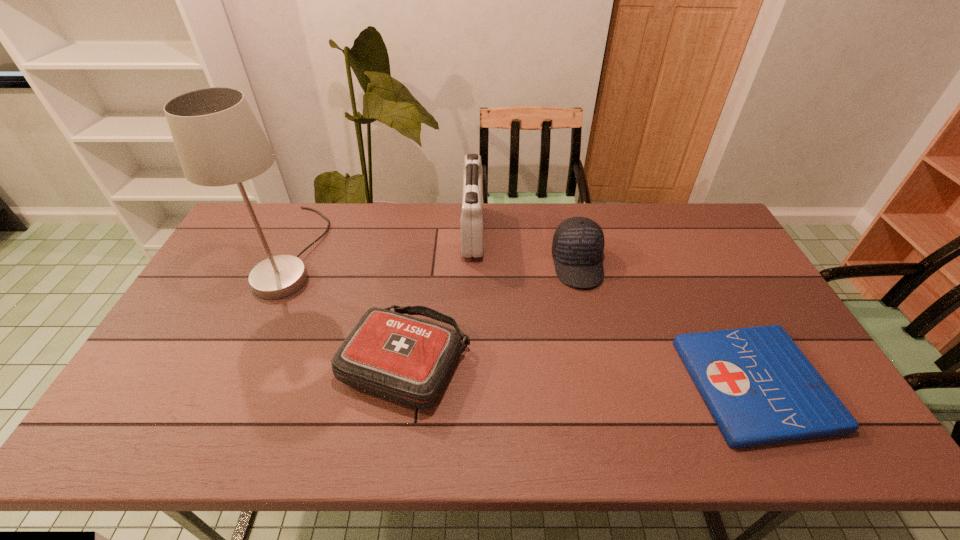
Locate an element on the screen. vacant space that is in between the fourth shortest object and the rightmost object is located at coordinates (613, 308).

Locate an element on the screen. This screenshot has height=540, width=960. unoccupied position between the second tallest object and the second tallest first-aid kit is located at coordinates (440, 298).

This screenshot has height=540, width=960. I want to click on free point between the third tallest object and the second tallest object, so click(525, 248).

I want to click on vacant area between the second shortest first-aid kit and the second tallest object, so click(440, 298).

Locate an element on the screen. unoccupied position between the leftmost object and the rightmost first-aid kit is located at coordinates (524, 318).

Identify the location of empty space between the second shortest object and the shortest object. The image size is (960, 540). (580, 373).

Find the location of `the fourth closest object to the baseball cap`. the fourth closest object to the baseball cap is located at coordinates (219, 142).

Identify which object is the second closest to the second object from right to left. Please provide its 2D coordinates. Your answer should be formatted as a tuple, i.e. [(x, y)], where the tuple contains the x and y coordinates of a point satisfying the conditions above.

[(472, 218)]

Find the location of `the closest first-aid kit relative to the tallest object`. the closest first-aid kit relative to the tallest object is located at coordinates (408, 360).

Select which first-aid kit is the closest to the second shortest object. Please provide its 2D coordinates. Your answer should be formatted as a tuple, i.e. [(x, y)], where the tuple contains the x and y coordinates of a point satisfying the conditions above.

[(472, 218)]